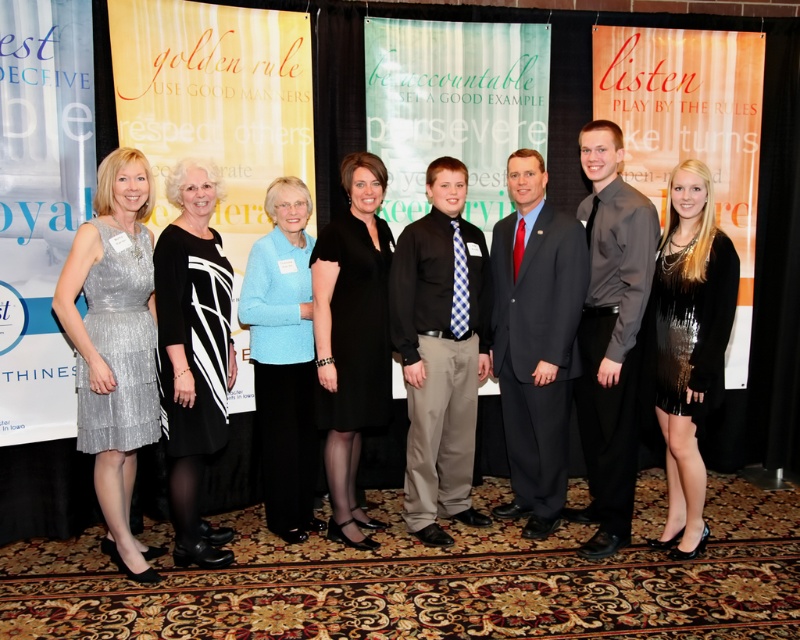
You are a photographer at the event. You need to adjust the lighting so that both the matte gray shirt at center and the black sequined dress at center are equally visible. Considering their heights, which one might need more lighting adjustment? Explain your reasoning.

The matte gray shirt at center is much taller than the black sequined dress at center. Therefore, the black sequined dress at center might need more lighting adjustment because it is shorter and could be in a shadowed area beneath the taller matte gray shirt at center.

You are a photographer adjusting the camera settings for the group photo. You need to ensure that both the dark gray suit at center and the black and white dress at center are in focus. Which object requires a wider aperture setting to capture its details properly?

The dark gray suit at center has a larger width than the black and white dress at center, so it requires a wider aperture setting to capture its details properly.

You are standing in front of the group photo and want to locate the matte gray shirt at center. Can you tell me its exact position in the image using coordinates?

The matte gray shirt at center is located at the 2D coordinates point (610, 333).